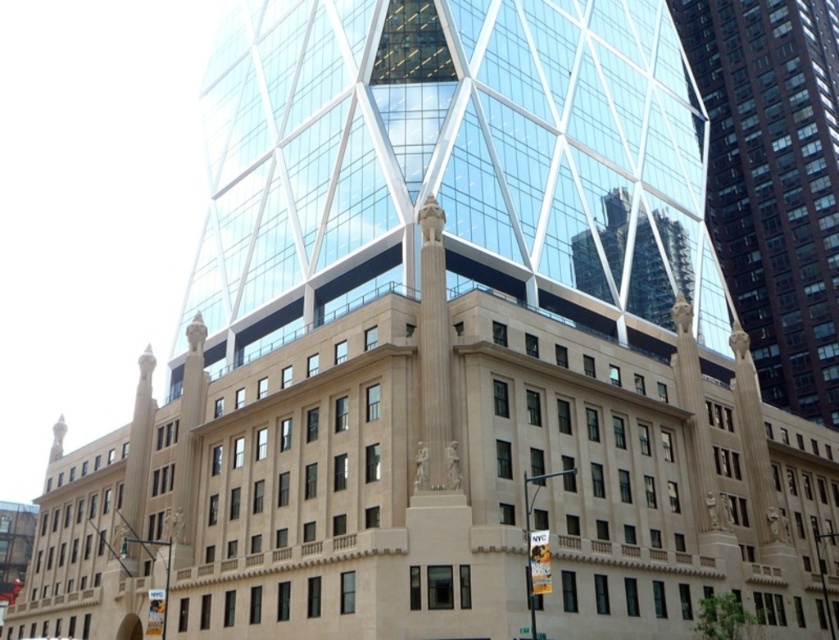
Question: Can you confirm if brown glass building at center is thinner than metallic silver car at center?

Choices:
 (A) no
 (B) yes

Answer: (A)

Question: Does brown glass building at center appear over metallic silver car at center?

Choices:
 (A) yes
 (B) no

Answer: (A)

Question: Can you confirm if brown glass building at center is positioned below metallic silver car at center?

Choices:
 (A) no
 (B) yes

Answer: (A)

Question: Among these points, which one is nearest to the camera?

Choices:
 (A) (759, 115)
 (B) (74, 637)

Answer: (B)